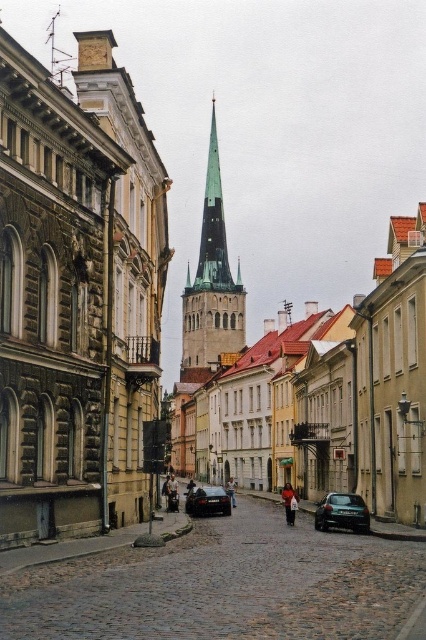
Question: Which point is closer to the camera?

Choices:
 (A) tap(192, 490)
 (B) tap(129, 84)

Answer: (B)

Question: Which object is positioned closest to the red fabric coat at center?

Choices:
 (A) dark blue jeans at center
 (B) denim jacket at center
 (C) shiny black car at center

Answer: (C)

Question: Does green glass spire at center lie in front of red fabric coat at center?

Choices:
 (A) yes
 (B) no

Answer: (B)

Question: Which point is closer to the camera taking this photo?

Choices:
 (A) (192, 488)
 (B) (232, 484)
 (C) (210, 122)

Answer: (A)

Question: Does stone tower at center appear over dark blue jeans at center?

Choices:
 (A) no
 (B) yes

Answer: (B)

Question: Is denim jacket at center closer to camera compared to dark blue jeans at center?

Choices:
 (A) no
 (B) yes

Answer: (B)